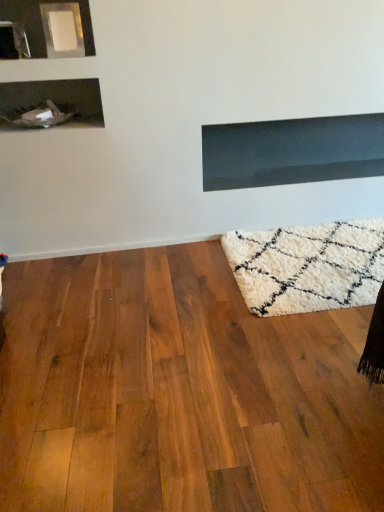
Describe the element at coordinates (179, 392) in the screenshot. Image resolution: width=384 pixels, height=512 pixels. I see `shiny brown hardwood floor at lower right` at that location.

Measure the distance between shiny brown hardwood floor at lower right and camera.

A distance of 3.53 feet exists between shiny brown hardwood floor at lower right and camera.

Locate an element on the screen. This screenshot has width=384, height=512. shiny brown hardwood floor at lower right is located at coordinates click(x=179, y=392).

Image resolution: width=384 pixels, height=512 pixels. Identify the location of matte black fireplace at upper center. (292, 151).

Describe the element at coordinates (292, 151) in the screenshot. The image size is (384, 512). I see `matte black fireplace at upper center` at that location.

Locate an element on the screen. shiny brown hardwood floor at lower right is located at coordinates (179, 392).

Does shiny brown hardwood floor at lower right appear on the right side of matte black fireplace at upper center?

Incorrect, shiny brown hardwood floor at lower right is not on the right side of matte black fireplace at upper center.

Which object is closer to the camera taking this photo, shiny brown hardwood floor at lower right or matte black fireplace at upper center?

shiny brown hardwood floor at lower right is in front.

Between point (92, 396) and point (346, 169), which one is positioned in front?

Point (92, 396)

From the image's perspective, is shiny brown hardwood floor at lower right positioned above or below matte black fireplace at upper center?

Based on their image positions, shiny brown hardwood floor at lower right is located beneath matte black fireplace at upper center.

From a real-world perspective, does shiny brown hardwood floor at lower right sit lower than matte black fireplace at upper center?

Indeed, from a real-world perspective, shiny brown hardwood floor at lower right is positioned beneath matte black fireplace at upper center.

Considering the sizes of objects shiny brown hardwood floor at lower right and matte black fireplace at upper center in the image provided, who is wider, shiny brown hardwood floor at lower right or matte black fireplace at upper center?

Wider between the two is shiny brown hardwood floor at lower right.

Is shiny brown hardwood floor at lower right shorter than matte black fireplace at upper center?

Yes.

Is shiny brown hardwood floor at lower right bigger than matte black fireplace at upper center?

Yes.

Is shiny brown hardwood floor at lower right inside the boundaries of matte black fireplace at upper center, or outside?

shiny brown hardwood floor at lower right cannot be found inside matte black fireplace at upper center.

Looking at this image, is shiny brown hardwood floor at lower right far from matte black fireplace at upper center?

shiny brown hardwood floor at lower right is far away from matte black fireplace at upper center.

Is shiny brown hardwood floor at lower right oriented towards matte black fireplace at upper center?

No, shiny brown hardwood floor at lower right does not turn towards matte black fireplace at upper center.

How many degrees apart are the facing directions of shiny brown hardwood floor at lower right and matte black fireplace at upper center?

The facing directions of shiny brown hardwood floor at lower right and matte black fireplace at upper center are 0.0384 degrees apart.

Locate an element on the screen. The width and height of the screenshot is (384, 512). fireplace that is above the shiny brown hardwood floor at lower right (from the image's perspective) is located at coordinates (292, 151).

Would you say matte black fireplace at upper center is to the left or to the right of shiny brown hardwood floor at lower right in the picture?

From the image, it's evident that matte black fireplace at upper center is to the right of shiny brown hardwood floor at lower right.

Is matte black fireplace at upper center positioned before shiny brown hardwood floor at lower right?

No, matte black fireplace at upper center is behind shiny brown hardwood floor at lower right.

Which is less distant, (376, 162) or (358, 432)?

Point (376, 162) is positioned farther from the camera compared to point (358, 432).

From the image's perspective, would you say matte black fireplace at upper center is shown under shiny brown hardwood floor at lower right?

Actually, matte black fireplace at upper center appears above shiny brown hardwood floor at lower right in the image.

From a real-world perspective, between matte black fireplace at upper center and shiny brown hardwood floor at lower right, who is vertically lower?

In real-world perspective, shiny brown hardwood floor at lower right is lower.

Looking at their sizes, would you say matte black fireplace at upper center is wider or thinner than shiny brown hardwood floor at lower right?

Considering their sizes, matte black fireplace at upper center looks slimmer than shiny brown hardwood floor at lower right.

Considering the sizes of objects matte black fireplace at upper center and shiny brown hardwood floor at lower right in the image provided, who is taller, matte black fireplace at upper center or shiny brown hardwood floor at lower right?

matte black fireplace at upper center is taller.

Considering the sizes of objects matte black fireplace at upper center and shiny brown hardwood floor at lower right in the image provided, who is bigger, matte black fireplace at upper center or shiny brown hardwood floor at lower right?

Bigger between the two is shiny brown hardwood floor at lower right.

Is shiny brown hardwood floor at lower right a part of matte black fireplace at upper center?

Definitely not — shiny brown hardwood floor at lower right is not inside matte black fireplace at upper center.

Is matte black fireplace at upper center beside shiny brown hardwood floor at lower right?

There is a gap between matte black fireplace at upper center and shiny brown hardwood floor at lower right.

Is matte black fireplace at upper center facing towards shiny brown hardwood floor at lower right?

No, matte black fireplace at upper center is not facing towards shiny brown hardwood floor at lower right.

Find the location of a particular element. hardwood on the left of the matte black fireplace at upper center is located at coordinates tap(179, 392).

At what (x,y) coordinates should I click in order to perform the action: click on fireplace to the right of shiny brown hardwood floor at lower right. Please return your answer as a coordinate pair (x, y). Looking at the image, I should click on (292, 151).

At what (x,y) coordinates should I click in order to perform the action: click on hardwood on the left of the matte black fireplace at upper center. Please return your answer as a coordinate pair (x, y). The image size is (384, 512). Looking at the image, I should click on (179, 392).